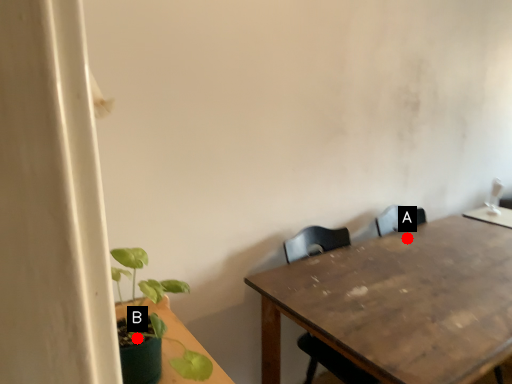
Question: Two points are circled on the image, labeled by A and B beside each circle. Which point appears farthest from the camera in this image?

Choices:
 (A) A is further
 (B) B is further

Answer: (A)